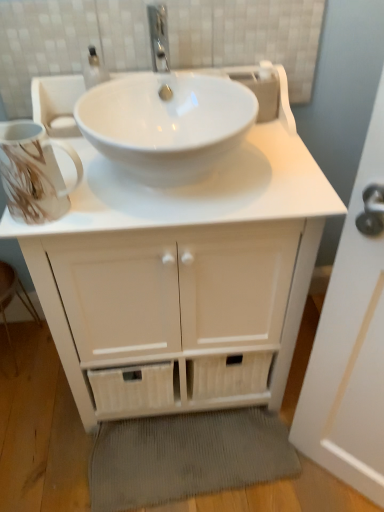
Question: Does white matte cabinet at center have a smaller size compared to gray corduroy bath mat at lower center?

Choices:
 (A) no
 (B) yes

Answer: (A)

Question: Is the depth of white matte cabinet at center greater than that of gray corduroy bath mat at lower center?

Choices:
 (A) yes
 (B) no

Answer: (B)

Question: Can you confirm if white matte cabinet at center is bigger than gray corduroy bath mat at lower center?

Choices:
 (A) no
 (B) yes

Answer: (B)

Question: Can you confirm if white matte cabinet at center is positioned to the left of gray corduroy bath mat at lower center?

Choices:
 (A) yes
 (B) no

Answer: (A)

Question: Is white matte cabinet at center located outside gray corduroy bath mat at lower center?

Choices:
 (A) no
 (B) yes

Answer: (B)

Question: From the image's perspective, is white matte cabinet at center below gray corduroy bath mat at lower center?

Choices:
 (A) yes
 (B) no

Answer: (B)

Question: Considering the relative sizes of white matte cabinet at center and wooden step stool at lower left in the image provided, is white matte cabinet at center thinner than wooden step stool at lower left?

Choices:
 (A) yes
 (B) no

Answer: (B)

Question: Does white matte cabinet at center have a lesser height compared to wooden step stool at lower left?

Choices:
 (A) no
 (B) yes

Answer: (A)

Question: Can you confirm if white matte cabinet at center is taller than wooden step stool at lower left?

Choices:
 (A) yes
 (B) no

Answer: (A)

Question: Considering the relative positions of white matte cabinet at center and wooden step stool at lower left in the image provided, is white matte cabinet at center behind wooden step stool at lower left?

Choices:
 (A) yes
 (B) no

Answer: (B)

Question: Does white matte cabinet at center turn towards wooden step stool at lower left?

Choices:
 (A) no
 (B) yes

Answer: (A)

Question: From the image's perspective, is white matte cabinet at center on top of wooden step stool at lower left?

Choices:
 (A) yes
 (B) no

Answer: (A)

Question: Is gray corduroy bath mat at lower center closer to the viewer compared to wooden step stool at lower left?

Choices:
 (A) yes
 (B) no

Answer: (A)